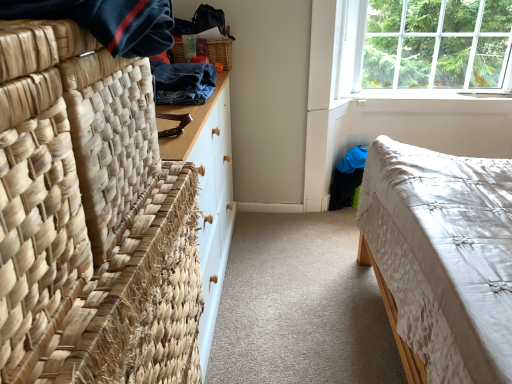
I want to click on free point above clear glass window at upper right (from a real-world perspective), so click(442, 1).